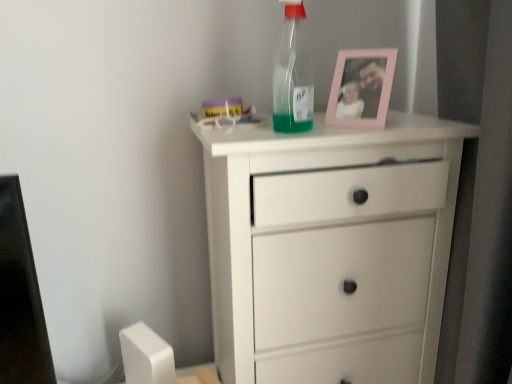
Question: Is pink plastic picture frame at upper center oriented away from transparent plastic bottle at upper center?

Choices:
 (A) yes
 (B) no

Answer: (B)

Question: From the image's perspective, does pink plastic picture frame at upper center appear higher than transparent plastic bottle at upper center?

Choices:
 (A) yes
 (B) no

Answer: (B)

Question: Is the position of pink plastic picture frame at upper center more distant than that of transparent plastic bottle at upper center?

Choices:
 (A) no
 (B) yes

Answer: (B)

Question: Does pink plastic picture frame at upper center touch transparent plastic bottle at upper center?

Choices:
 (A) no
 (B) yes

Answer: (A)

Question: From the image's perspective, would you say pink plastic picture frame at upper center is shown under transparent plastic bottle at upper center?

Choices:
 (A) yes
 (B) no

Answer: (A)

Question: Is pink plastic picture frame at upper center shorter than transparent plastic bottle at upper center?

Choices:
 (A) yes
 (B) no

Answer: (A)

Question: Is transparent plastic bottle at upper center oriented away from pink plastic picture frame at upper center?

Choices:
 (A) yes
 (B) no

Answer: (B)

Question: Does transparent plastic bottle at upper center have a lesser width compared to pink plastic picture frame at upper center?

Choices:
 (A) yes
 (B) no

Answer: (A)

Question: From the image's perspective, would you say transparent plastic bottle at upper center is positioned over pink plastic picture frame at upper center?

Choices:
 (A) no
 (B) yes

Answer: (B)

Question: Considering the relative sizes of transparent plastic bottle at upper center and pink plastic picture frame at upper center in the image provided, is transparent plastic bottle at upper center taller than pink plastic picture frame at upper center?

Choices:
 (A) yes
 (B) no

Answer: (A)

Question: Could you tell me if transparent plastic bottle at upper center is turned towards pink plastic picture frame at upper center?

Choices:
 (A) yes
 (B) no

Answer: (B)

Question: Is the surface of transparent plastic bottle at upper center in direct contact with pink plastic picture frame at upper center?

Choices:
 (A) no
 (B) yes

Answer: (A)

Question: Considering the relative sizes of pink plastic picture frame at upper center and white matte chest of drawers at center in the image provided, is pink plastic picture frame at upper center taller than white matte chest of drawers at center?

Choices:
 (A) no
 (B) yes

Answer: (A)